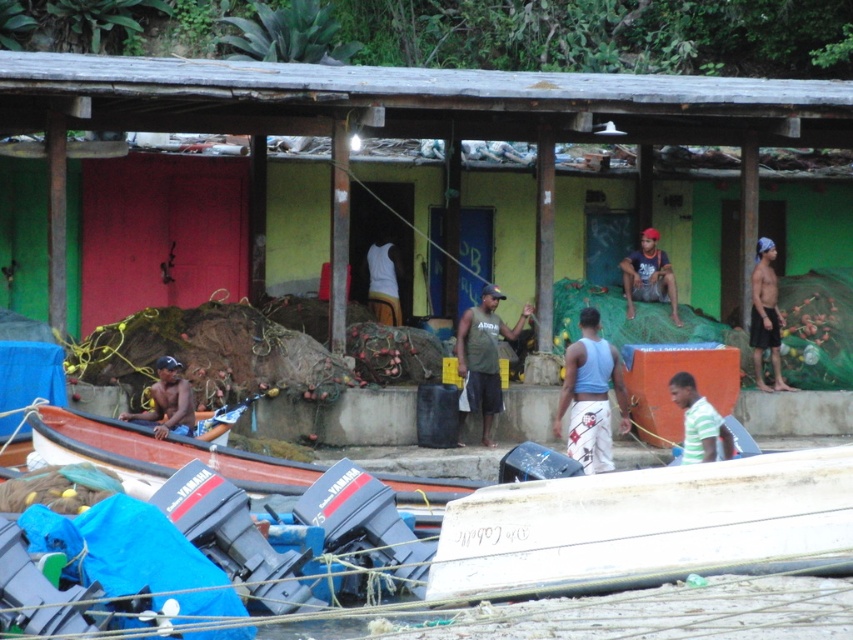
Does light blue tank top at center have a lesser height compared to matte black shirt at left?

No, light blue tank top at center is not shorter than matte black shirt at left.

What do you see at coordinates (590, 396) in the screenshot? This screenshot has width=853, height=640. I see `light blue tank top at center` at bounding box center [590, 396].

Which is behind, point (595, 324) or point (155, 424)?

The point (595, 324) is more distant.

I want to click on light blue tank top at center, so click(590, 396).

Between point (579, 422) and point (398, 304), which one is positioned in front?

Positioned in front is point (579, 422).

Can you confirm if light blue tank top at center is taller than white matte tank top at center?

Yes.

Describe the element at coordinates (590, 396) in the screenshot. I see `light blue tank top at center` at that location.

The image size is (853, 640). I want to click on light blue tank top at center, so click(590, 396).

Does brown wooden canoe at lower left appear on the left side of matte blue shorts at center?

Correct, you'll find brown wooden canoe at lower left to the left of matte blue shorts at center.

Is point (167, 465) behind point (651, 298)?

No, (167, 465) is in front of (651, 298).

The image size is (853, 640). What are the coordinates of `brown wooden canoe at lower left` in the screenshot? It's located at (157, 452).

Locate an element on the screen. Image resolution: width=853 pixels, height=640 pixels. brown wooden canoe at lower left is located at coordinates (157, 452).